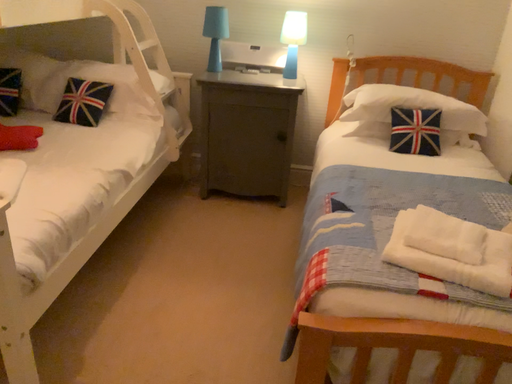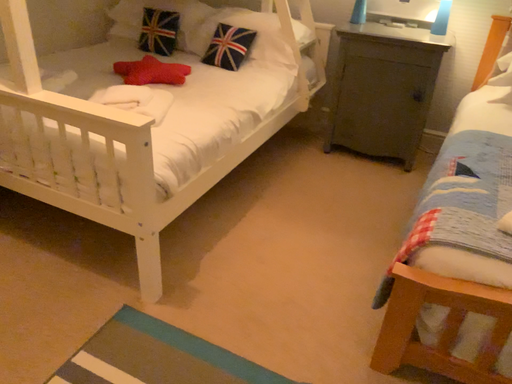
Question: How did the camera likely rotate when shooting the video?

Choices:
 (A) rotated left
 (B) rotated right

Answer: (A)